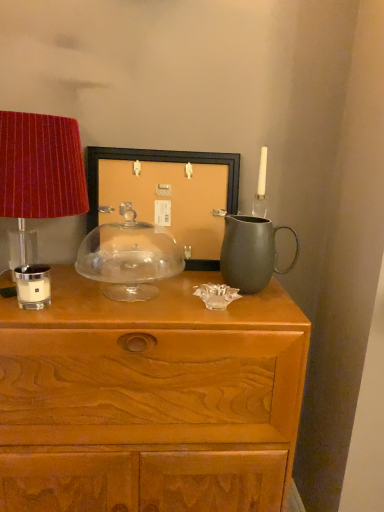
The image size is (384, 512). Find the location of `free space above matte black picture frame at center (from a real-world perspective)`. free space above matte black picture frame at center (from a real-world perspective) is located at coordinates (164, 146).